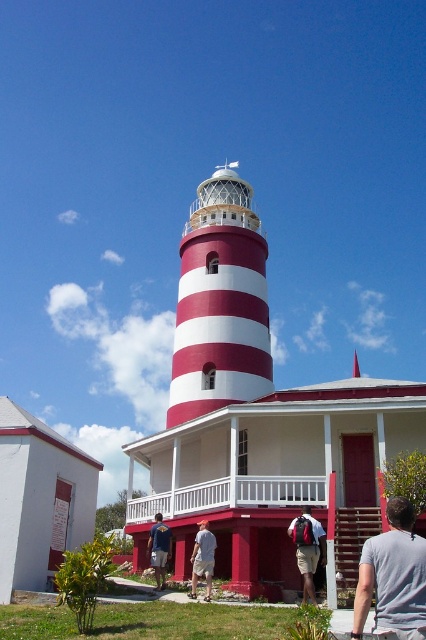
You are a photographer planning to take a picture of the white cotton shirt at center and the blue denim shorts at lower center. Which object should you focus on first if you want to ensure both are in sharp focus?

You should focus on the white cotton shirt at center first because it is wider than the blue denim shorts at lower center, so focusing on the wider object can help achieve better depth of field for both.